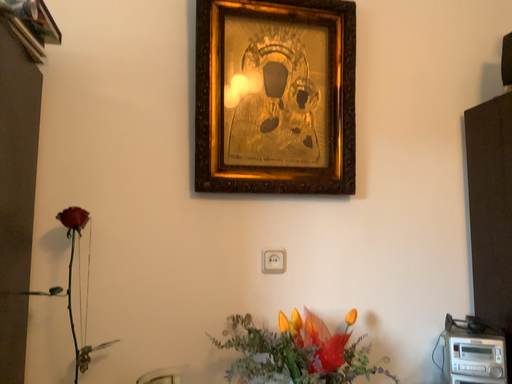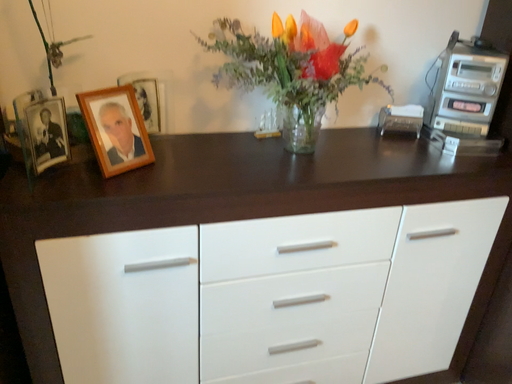
Question: How did the camera likely rotate when shooting the video?

Choices:
 (A) rotated downward
 (B) rotated upward

Answer: (A)